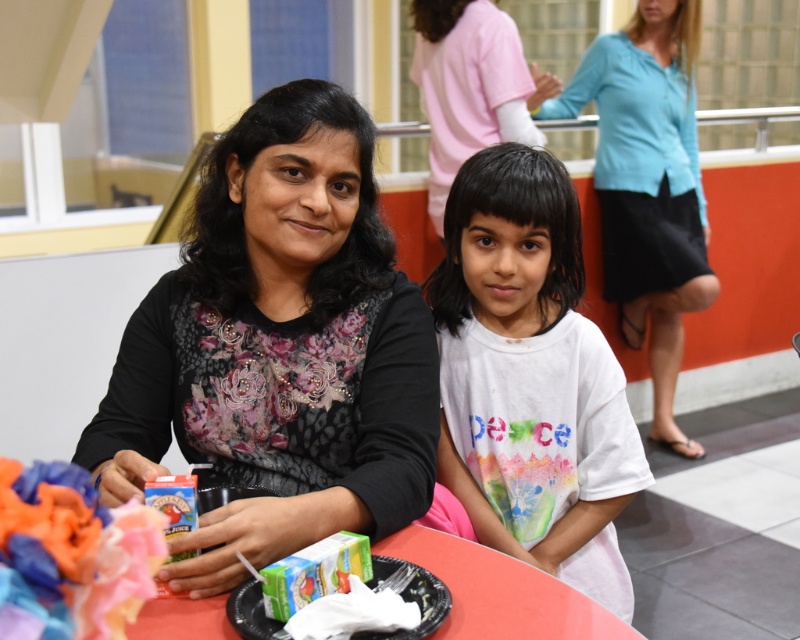
Is white cotton shirt at center positioned at the back of matte plastic juice box at center?

Yes, it is behind matte plastic juice box at center.

What do you see at coordinates (530, 378) in the screenshot? Image resolution: width=800 pixels, height=640 pixels. I see `white cotton shirt at center` at bounding box center [530, 378].

Where is `white cotton shirt at center`? Image resolution: width=800 pixels, height=640 pixels. white cotton shirt at center is located at coordinates (530, 378).

Does point (674, 115) come closer to viewer compared to point (80, 605)?

That is False.

Does point (664, 76) come behind point (24, 544)?

Yes, point (664, 76) is behind point (24, 544).

Which is in front, point (680, 131) or point (24, 579)?

Point (24, 579) is more forward.

Identify the location of blue fabric skirt at upper right. (646, 186).

Is matte plastic juice box at center shorter than green cardboard juice box at lower center?

Incorrect, matte plastic juice box at center's height does not fall short of green cardboard juice box at lower center's.

Does matte plastic juice box at center have a greater height compared to green cardboard juice box at lower center?

Correct, matte plastic juice box at center is much taller as green cardboard juice box at lower center.

Between point (85, 618) and point (256, 602), which one is positioned behind?

Point (256, 602)

The height and width of the screenshot is (640, 800). What are the coordinates of `matte plastic juice box at center` in the screenshot? It's located at coord(70,554).